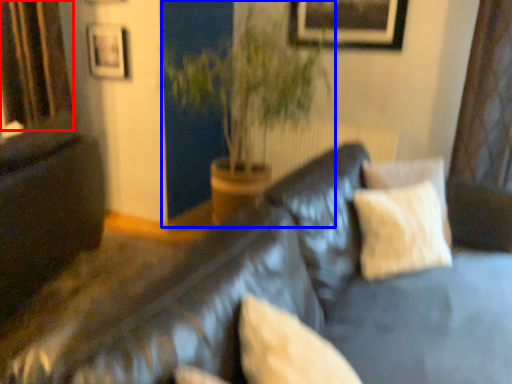
Question: Which point is closer to the camera, curtain (highlighted by a red box) or houseplant (highlighted by a blue box)?

Choices:
 (A) curtain
 (B) houseplant

Answer: (B)